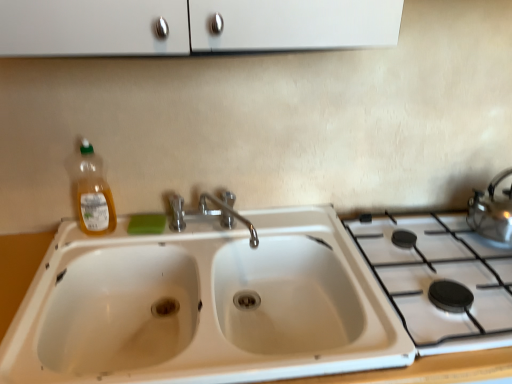
Where is `free location in front of green matte soap at center`? This screenshot has width=512, height=384. free location in front of green matte soap at center is located at coordinates (136, 246).